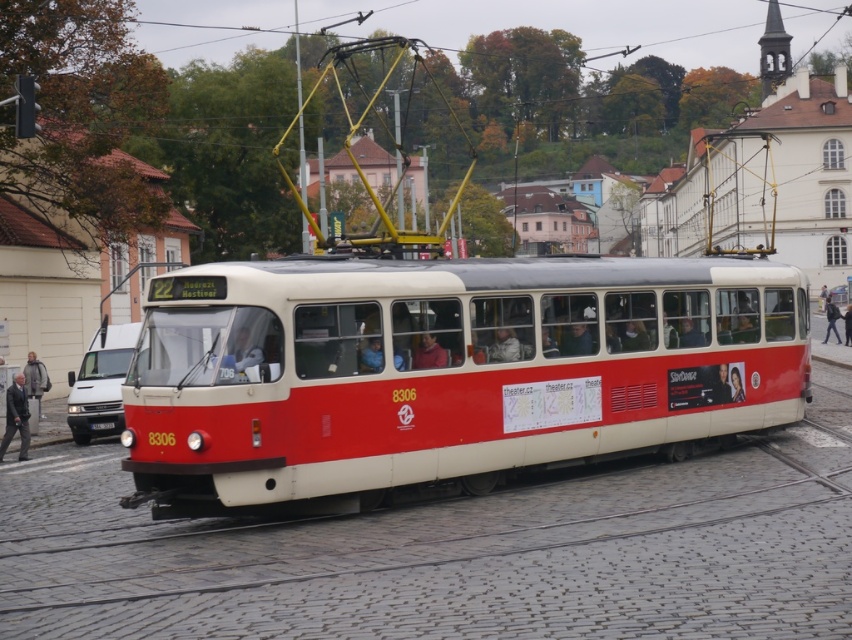
Who is more forward, (504,552) or (427,353)?

Point (504,552)

Does red rubber track at center have a greater height compared to matte red jacket at center?

Correct, red rubber track at center is much taller as matte red jacket at center.

Where is `red rubber track at center`? This screenshot has height=640, width=852. red rubber track at center is located at coordinates (458, 552).

Identify the location of red rubber track at center. (458, 552).

Who is lower down, dark gray jacket at left or matte beige jacket at center?

dark gray jacket at left

Between point (32, 365) and point (508, 340), which one is positioned in front?

Point (508, 340) is in front.

The height and width of the screenshot is (640, 852). In order to click on dark gray jacket at left in this screenshot , I will do `click(35, 378)`.

Who is positioned more to the left, red rubber track at center or dark gray jacket at left?

dark gray jacket at left

Is red rubber track at center bigger than dark gray jacket at left?

Correct, red rubber track at center is larger in size than dark gray jacket at left.

Which is behind, point (769, 540) or point (45, 381)?

The point (45, 381) is more distant.

Image resolution: width=852 pixels, height=640 pixels. Find the location of `red rubber track at center`. red rubber track at center is located at coordinates (458, 552).